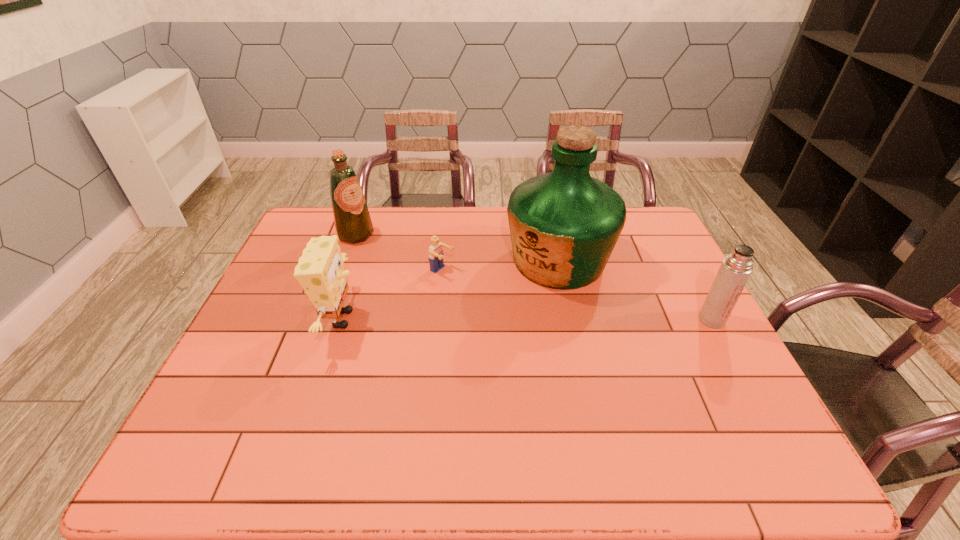
You are a GUI agent. You are given a task and a screenshot of the screen. Output one action in this format:
    pyautogui.click(x=<x>, y=<y>)
    Task: Click on the vacant space that satisfies the following two spatial constraints: 1. on the front side of the Lego; 2. on the left side of the rightmost object
    This screenshot has width=960, height=540.
    Given the screenshot: What is the action you would take?
    pyautogui.click(x=438, y=320)

Where is `vacant space that satisfies the following two spatial constraints: 1. on the front side of the tallest object; 2. on the left side of the rightmost object`? This screenshot has height=540, width=960. vacant space that satisfies the following two spatial constraints: 1. on the front side of the tallest object; 2. on the left side of the rightmost object is located at coordinates (571, 320).